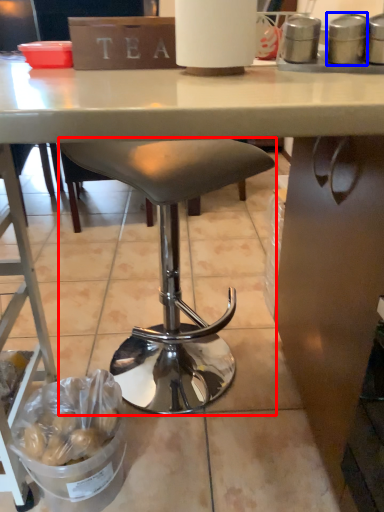
Question: Which object appears closest to the camera in this image, stool (highlighted by a red box) or appliance (highlighted by a blue box)?

Choices:
 (A) stool
 (B) appliance

Answer: (B)